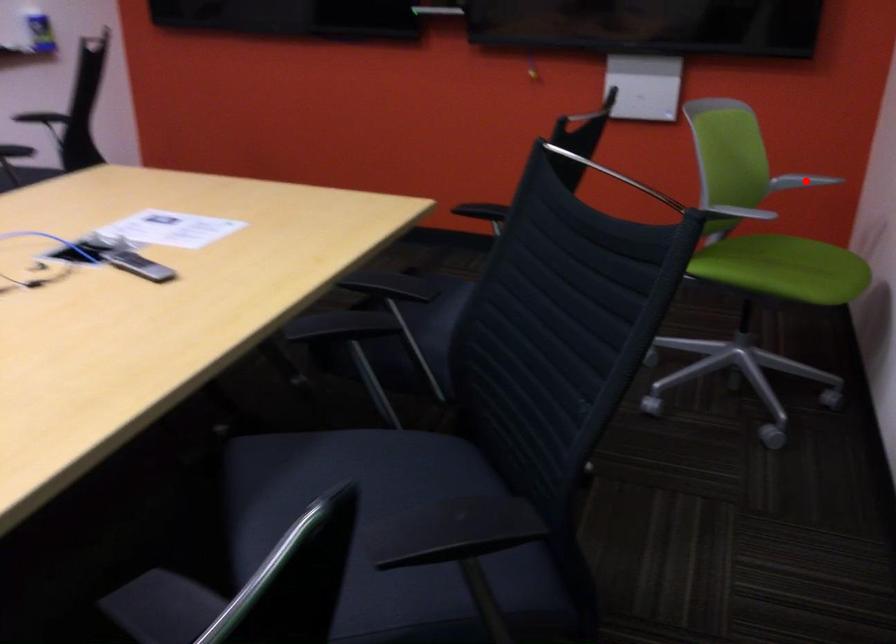
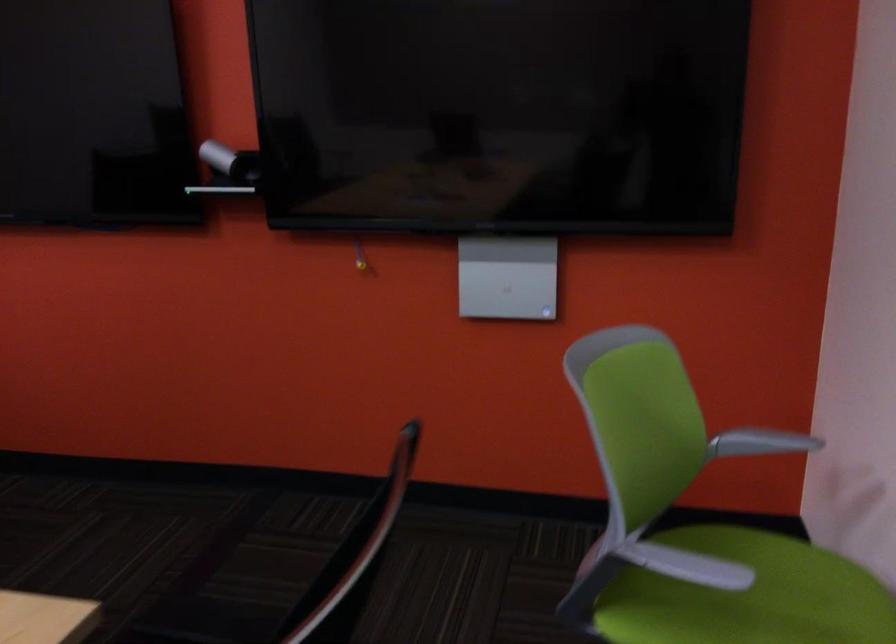
Question: A red point is marked in image1. In image2, is the corresponding 3D point closer to the camera or farther? Reply with the corresponding letter.

Choices:
 (A) The corresponding 3D point is closer.
 (B) The corresponding 3D point is farther.

Answer: (A)